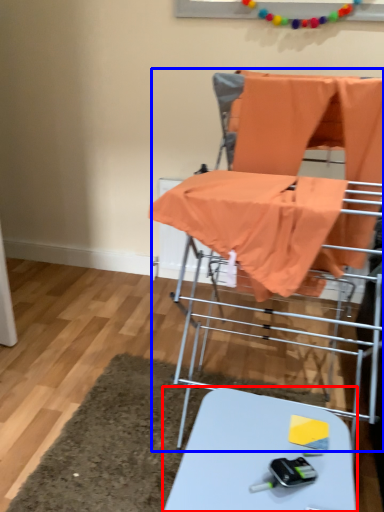
Question: Which of the following is the farthest to the observer, table (highlighted by a red box) or baby carriage (highlighted by a blue box)?

Choices:
 (A) table
 (B) baby carriage

Answer: (B)